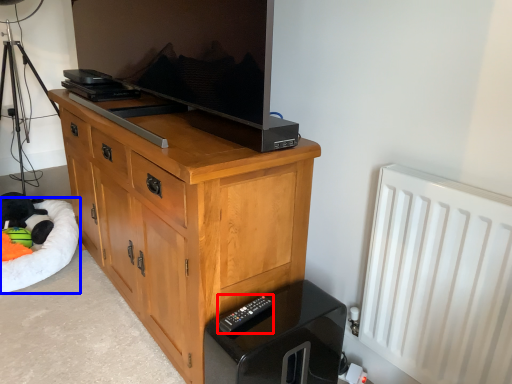
Question: Which object is further to the camera taking this photo, remote (highlighted by a red box) or dog bed (highlighted by a blue box)?

Choices:
 (A) remote
 (B) dog bed

Answer: (B)